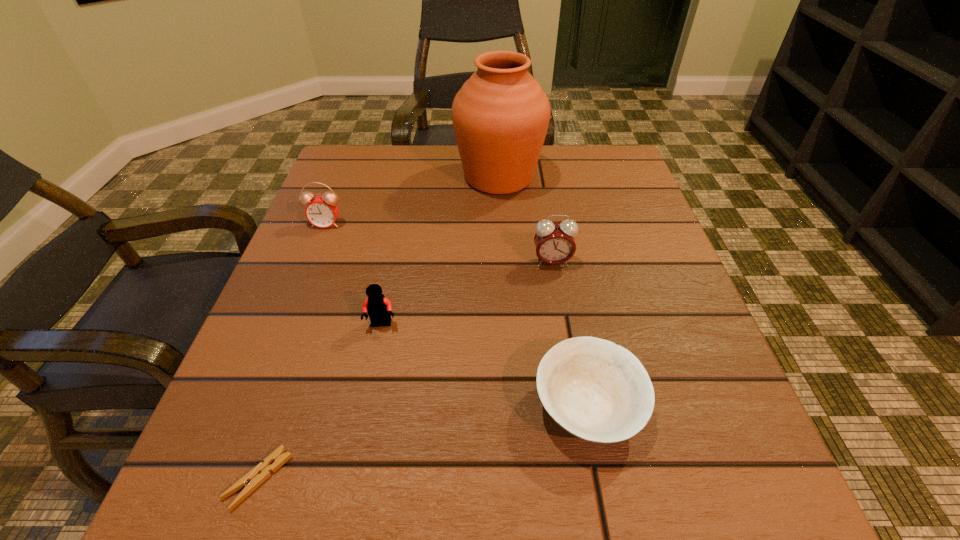
What are the coordinates of `vacant point located between the Lego and the fourth nearest object` in the screenshot? It's located at (467, 293).

Where is `free spot between the Lego and the farther alarm clock`? This screenshot has width=960, height=540. free spot between the Lego and the farther alarm clock is located at coordinates (354, 274).

You are a GUI agent. You are given a task and a screenshot of the screen. Output one action in this format:
    pyautogui.click(x=<x>, y=<y>)
    Task: Click on the vacant space in between the shortest object and the nearer alarm clock
    
    Given the screenshot: What is the action you would take?
    (x=405, y=370)

The image size is (960, 540). What are the coordinates of `vacant space that is in between the fourth farthest object and the left alarm clock` in the screenshot? It's located at (354, 274).

The image size is (960, 540). I want to click on vacant space in between the farthest object and the shortest object, so click(x=378, y=328).

Find the location of `vacant area between the farthest object and the left alarm clock`. vacant area between the farthest object and the left alarm clock is located at coordinates (413, 200).

Identify the location of unoccupied area between the farthest object and the fourth object from right to left. (441, 251).

The width and height of the screenshot is (960, 540). Identify the location of free area in between the shortest object and the fourth nearest object. (405, 370).

You are a GUI agent. You are given a task and a screenshot of the screen. Output one action in this format:
    pyautogui.click(x=<x>, y=<y>)
    Task: Click on the free space between the fourth nearest object and the fifth nearest object
    
    Given the screenshot: What is the action you would take?
    pyautogui.click(x=439, y=243)

Identify the location of free point between the right alarm clock and the tallest object. (525, 220).